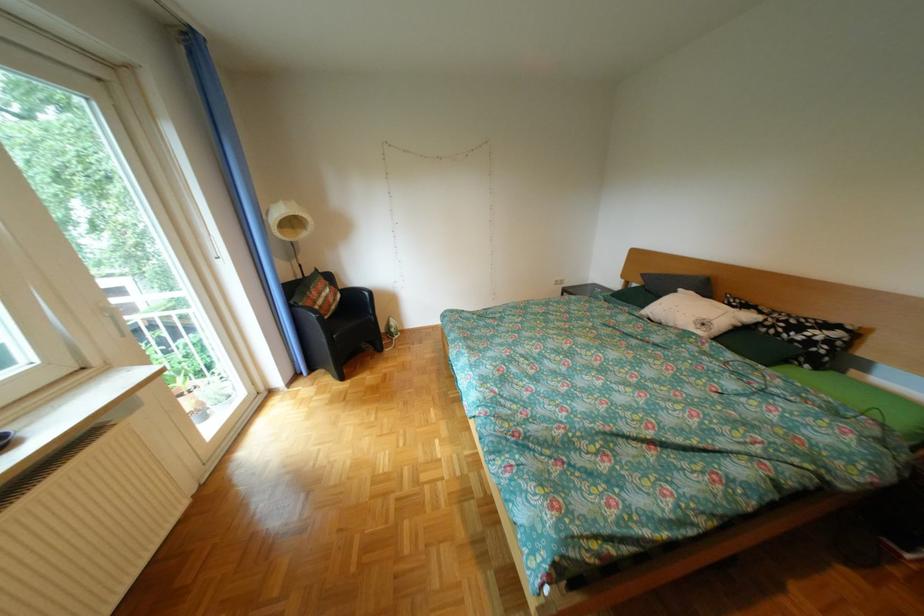
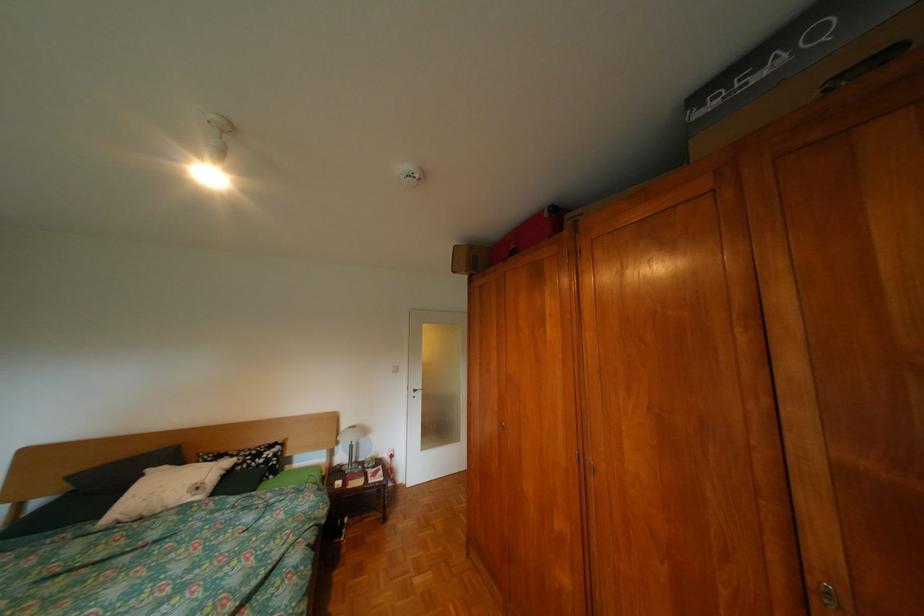
Question: The camera is either moving clockwise (left) or counter-clockwise (right) around the object. The first image is from the beginning of the video and the second image is from the end. Is the camera moving left or right when shooting the video?

Choices:
 (A) Left
 (B) Right

Answer: (A)